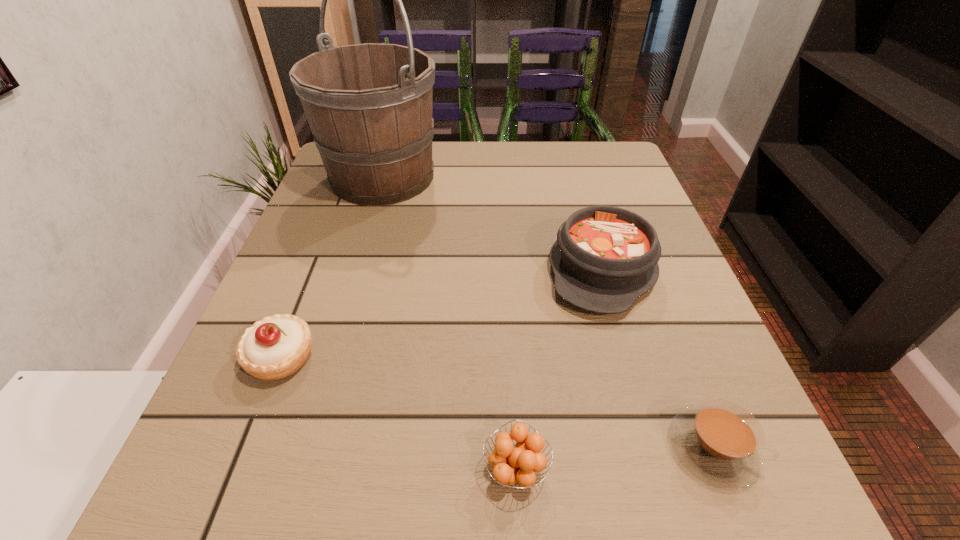
Find the location of a particular element. Image resolution: width=960 pixels, height=540 pixels. the tallest object is located at coordinates (369, 106).

Where is `bucket`? bucket is located at coordinates (369, 106).

Find the location of a particular element. casserole is located at coordinates (605, 258).

Where is `pastry`? This screenshot has width=960, height=540. pastry is located at coordinates (275, 347).

Find the location of `cappuccino`. cappuccino is located at coordinates (719, 442).

Where is `orange fruit`? The width and height of the screenshot is (960, 540). orange fruit is located at coordinates click(x=510, y=465).

This screenshot has height=540, width=960. I want to click on vacant space located 0.140m on the right of the bucket, so click(501, 177).

You are a GUI agent. You are given a task and a screenshot of the screen. Output one action in this format:
    pyautogui.click(x=<x>, y=<y>)
    Task: Click on the vacant space located on the left of the fourth nearest object
    
    Given the screenshot: What is the action you would take?
    pyautogui.click(x=485, y=269)

Where is `vacant area situated 0.170m on the right of the pastry`? vacant area situated 0.170m on the right of the pastry is located at coordinates (425, 357).

In order to click on free location located 0.100m on the back of the cappuccino in this screenshot , I will do `click(675, 351)`.